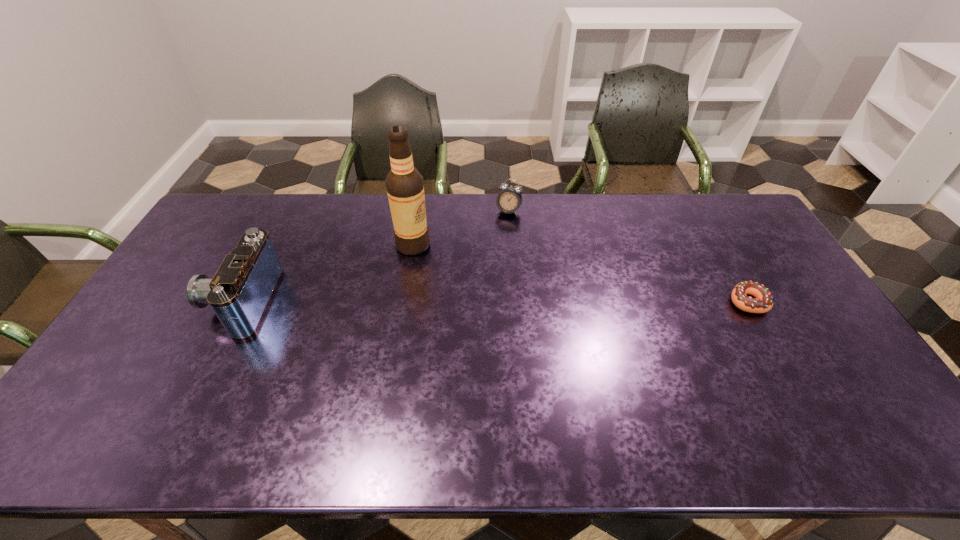
Locate an element on the screen. The width and height of the screenshot is (960, 540). vacant space on the desktop that is between the leftmost object and the doughnut and is positioned on the face of the second object from right to left is located at coordinates (467, 301).

What are the coordinates of `vacant space on the desktop that is between the third shortest object and the shortest object and is positioned on the label of the alcohol` in the screenshot? It's located at (476, 301).